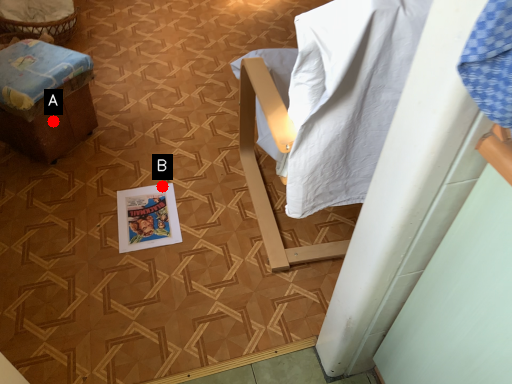
Question: Two points are circled on the image, labeled by A and B beside each circle. Which point is farther from the camera taking this photo?

Choices:
 (A) A is further
 (B) B is further

Answer: (B)